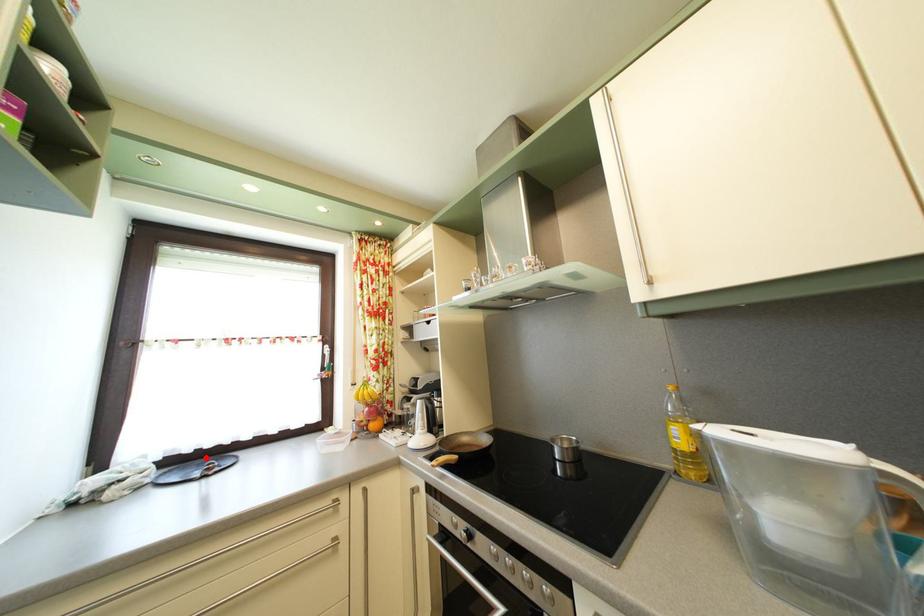
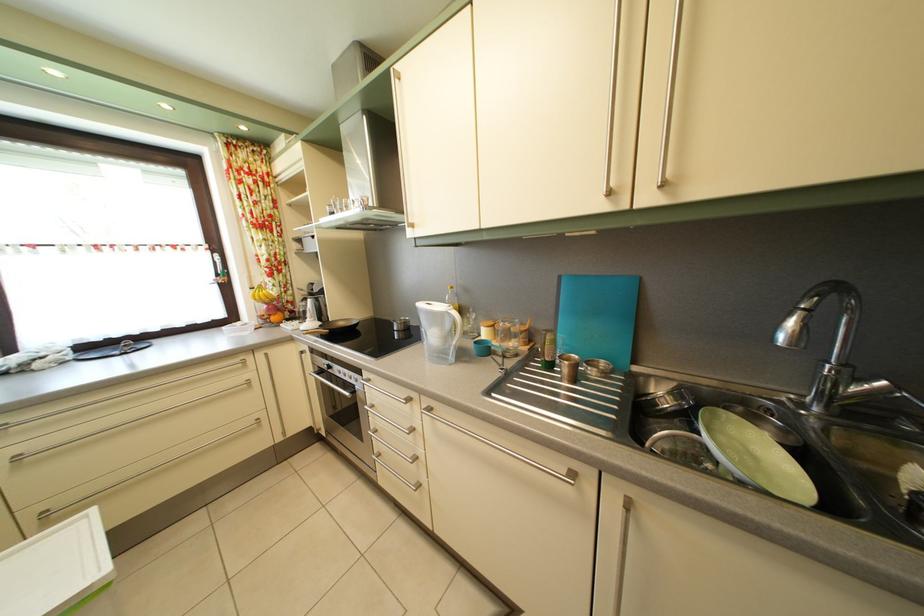
In the second image, find the point that corresponds to the highlighted location in the first image.

(116, 347)